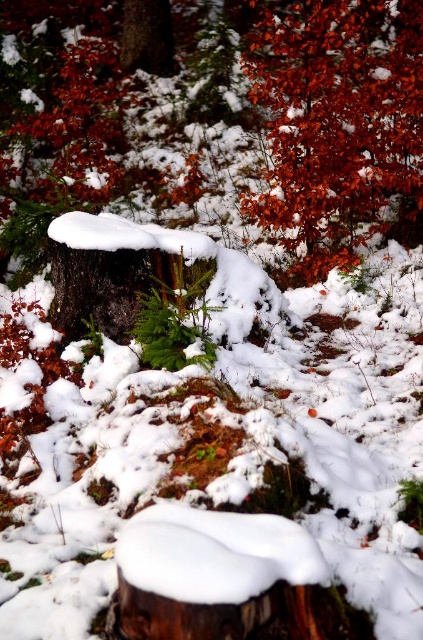
You are an explorer in the winter forest and need to reach a hidden cave entrance. The path to the cave is blocked by the shiny red leaves at upper right and the green matte fern at center. Which object must you move first to clear the path?

The green matte fern at center is behind the shiny red leaves at upper right, so you must move the shiny red leaves at upper right first to access the fern and clear the path.

You are an artist wanting to paint the winter forest scene. You notice the shiny red leaves at upper right and the green matte fern at center. Which object should you paint first if you follow the standard left to right painting technique?

You should paint the green matte fern at center first because the shiny red leaves at upper right is to the right of it, following the left to right painting technique.